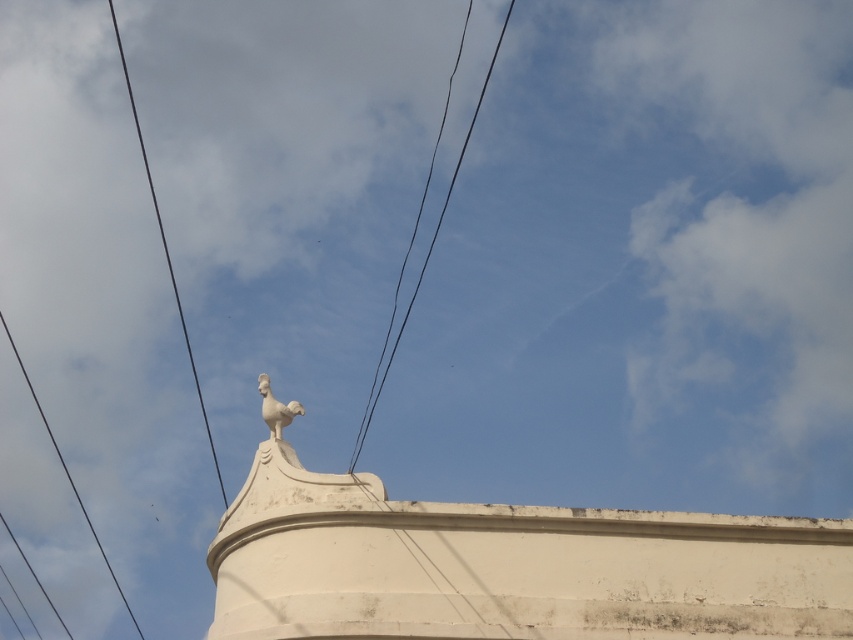
Who is more distant from viewer, (x=190, y=346) or (x=408, y=301)?

The point (x=190, y=346) is more distant.

Who is higher up, black wire at left or black wire at center?

black wire at left

Does point (138, 131) lie in front of point (352, 456)?

That is False.

Where is `black wire at left`? black wire at left is located at coordinates (166, 252).

The width and height of the screenshot is (853, 640). What do you see at coordinates (428, 248) in the screenshot?
I see `black wire at center` at bounding box center [428, 248].

Can you confirm if black wire at center is positioned above black wire at upper left?

Yes, black wire at center is above black wire at upper left.

What do you see at coordinates (428, 248) in the screenshot? I see `black wire at center` at bounding box center [428, 248].

Identify the location of black wire at center. The width and height of the screenshot is (853, 640). (428, 248).

Is black wire at left thinner than white stone rooster at upper center?

In fact, black wire at left might be wider than white stone rooster at upper center.

In the scene shown: Is black wire at left wider than white stone rooster at upper center?

Yes, black wire at left is wider than white stone rooster at upper center.

Who is more distant from viewer, (x=138, y=131) or (x=267, y=404)?

The point (x=138, y=131) is more distant.

Locate an element on the screen. This screenshot has width=853, height=640. black wire at left is located at coordinates [166, 252].